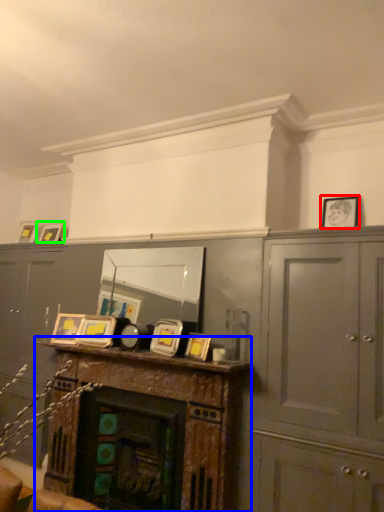
Question: Estimate the real-world distances between objects in this image. Which object is closer to picture frame (highlighted by a red box), table (highlighted by a blue box) or picture frame (highlighted by a green box)?

Choices:
 (A) table
 (B) picture frame

Answer: (A)